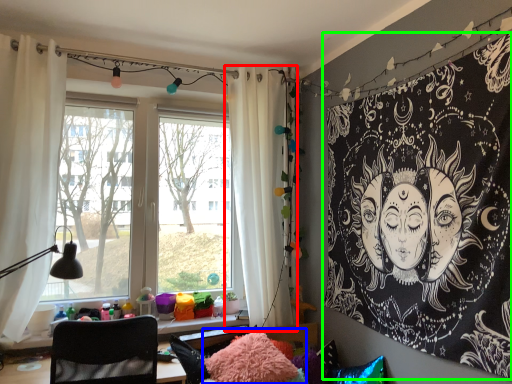
Question: Considering the real-world distances, which object is farthest from curtain (highlighted by a red box)? pillow (highlighted by a blue box) or bulletin board (highlighted by a green box)?

Choices:
 (A) pillow
 (B) bulletin board

Answer: (B)